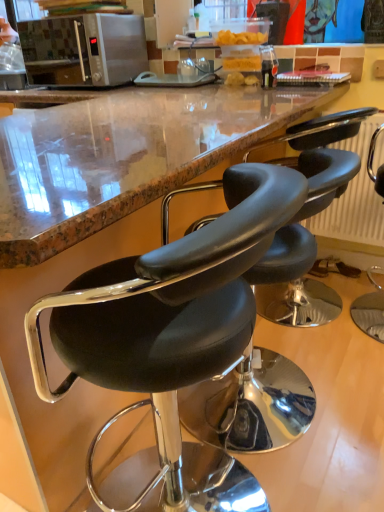
Question: From a real-world perspective, is black leather stool at center, positioned as the first chair in left-to-right order, under black leather chair at right, the 3th chair in the left-to-right sequence?

Choices:
 (A) no
 (B) yes

Answer: (A)

Question: Is black leather stool at center, positioned as the first chair in left-to-right order, not near black leather chair at right, the 3th chair in the left-to-right sequence?

Choices:
 (A) no
 (B) yes

Answer: (B)

Question: Can you confirm if black leather stool at center, arranged as the third chair when viewed from the right, is smaller than black leather chair at right, which appears as the first chair when viewed from the right?

Choices:
 (A) no
 (B) yes

Answer: (A)

Question: Is black leather stool at center, positioned as the first chair in left-to-right order, not inside black leather chair at right, the 3th chair in the left-to-right sequence?

Choices:
 (A) no
 (B) yes

Answer: (B)

Question: Is black leather stool at center, positioned as the first chair in left-to-right order, facing away from black leather chair at right, which appears as the first chair when viewed from the right?

Choices:
 (A) no
 (B) yes

Answer: (A)

Question: Is black leather stool at center, positioned as the first chair in left-to-right order, positioned behind black leather chair at right, which appears as the first chair when viewed from the right?

Choices:
 (A) yes
 (B) no

Answer: (B)

Question: From the image's perspective, does black leather stool at center, the 2th chair from the left, appear higher than satin silver microwave at upper left?

Choices:
 (A) yes
 (B) no

Answer: (B)

Question: Can you confirm if black leather stool at center, the 2th chair from the left, is taller than satin silver microwave at upper left?

Choices:
 (A) no
 (B) yes

Answer: (B)

Question: Is the depth of black leather stool at center, the 2th chair from the left, greater than that of satin silver microwave at upper left?

Choices:
 (A) yes
 (B) no

Answer: (B)

Question: Considering the relative sizes of black leather stool at center, the 2th chair from the right, and satin silver microwave at upper left in the image provided, is black leather stool at center, the 2th chair from the right, shorter than satin silver microwave at upper left?

Choices:
 (A) yes
 (B) no

Answer: (B)

Question: Are black leather stool at center, the 2th chair from the left, and satin silver microwave at upper left far apart?

Choices:
 (A) no
 (B) yes

Answer: (B)

Question: From a real-world perspective, is black leather stool at center, the 2th chair from the left, located beneath satin silver microwave at upper left?

Choices:
 (A) yes
 (B) no

Answer: (A)

Question: From a real-world perspective, is black leather chair at right, the 3th chair in the left-to-right sequence, below black leather stool at center, arranged as the third chair when viewed from the right?

Choices:
 (A) no
 (B) yes

Answer: (B)